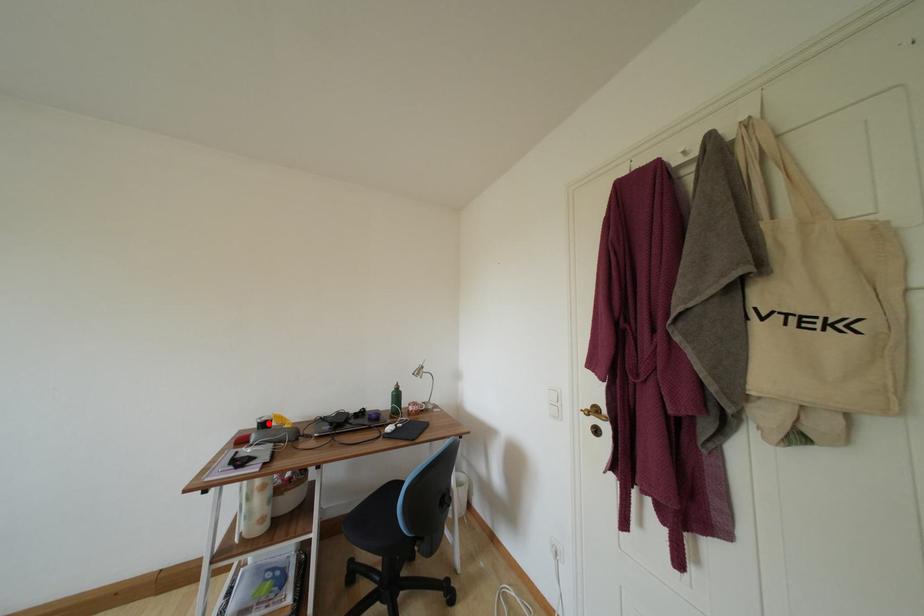
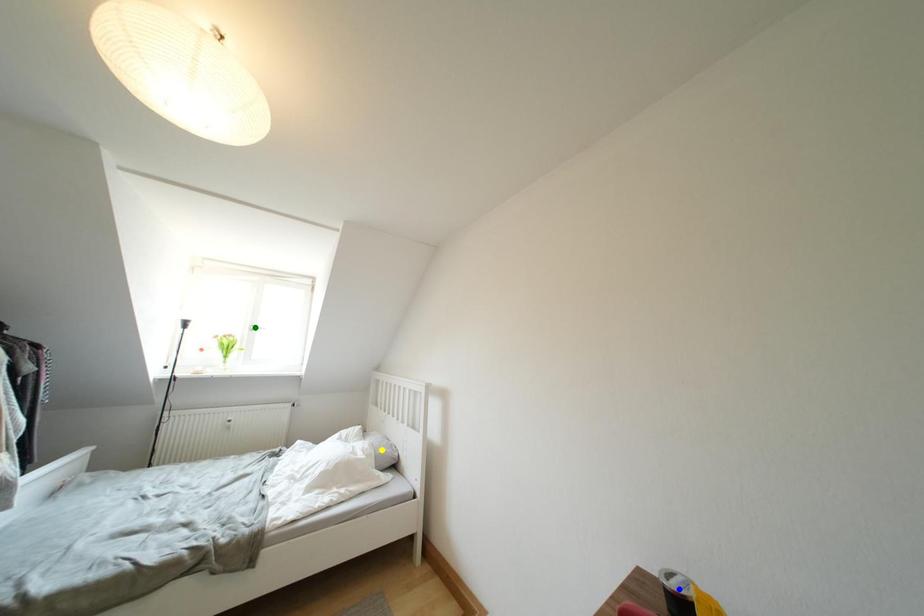
Question: I am providing you with two images of the same scene from different viewpoints. A red point is marked on the first image. You are given multiple points on the second image. Which point in image 2 represents the same 3d spot as the red point in image 1?

Choices:
 (A) blue point
 (B) green point
 (C) yellow point

Answer: (A)